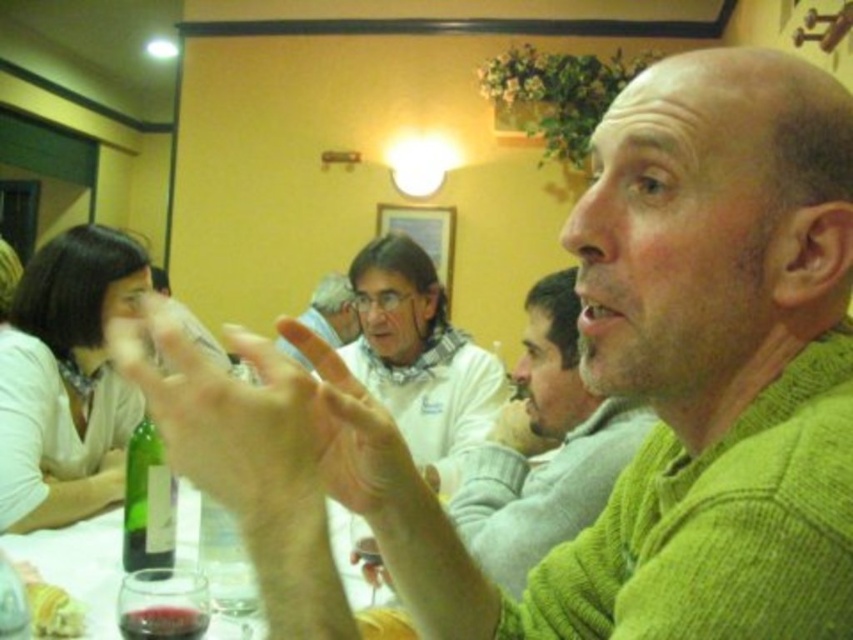
Question: In this image, where is green knitted sweater at upper right located relative to translucent glass wine at lower left?

Choices:
 (A) left
 (B) right

Answer: (B)

Question: Which point is closer to the camera taking this photo?

Choices:
 (A) (544, 284)
 (B) (167, 579)
 (C) (161, 552)
 (D) (425, 396)

Answer: (B)

Question: From the image, what is the correct spatial relationship of translucent glass at lower left in relation to yellow fluffy bread at lower left?

Choices:
 (A) right
 (B) left

Answer: (A)

Question: Which of the following is the closest to the observer?

Choices:
 (A) (270, 346)
 (B) (131, 456)
 (C) (543, 406)
 (D) (320, 280)

Answer: (A)

Question: Which point is closer to the camera?

Choices:
 (A) (553, 289)
 (B) (410, 321)

Answer: (A)

Question: Is green knitted sweater at upper right bigger than white textured sweater at center?

Choices:
 (A) yes
 (B) no

Answer: (B)